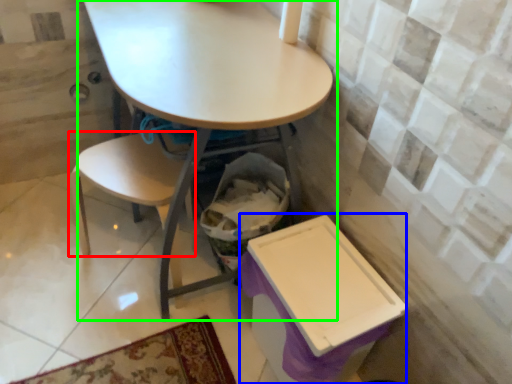
Question: Which object is the farthest from chair (highlighted by a red box)? Choose among these: box (highlighted by a blue box) or table (highlighted by a green box).

Choices:
 (A) box
 (B) table

Answer: (A)